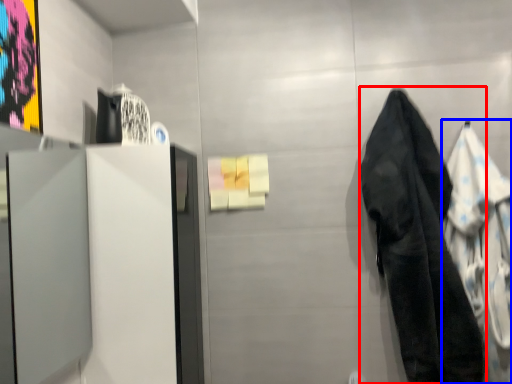
Question: Which object is further to the camera taking this photo, towel/napkin (highlighted by a red box) or cloak (highlighted by a blue box)?

Choices:
 (A) towel/napkin
 (B) cloak

Answer: (B)